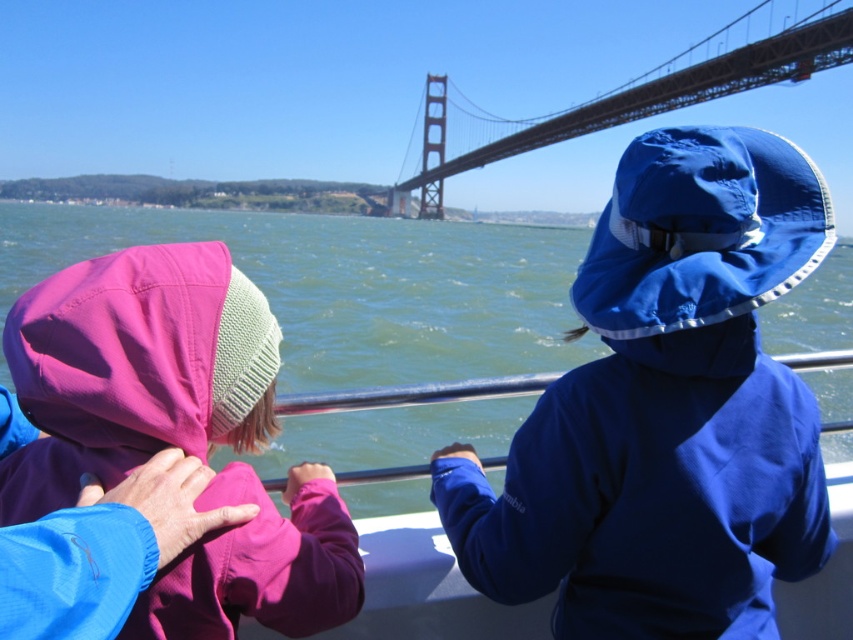
You are a photographer standing at the back of the boat. You want to take a closeup photo of the blue matte sun hat at upper right. Given that your camera has a maximum focus range of 7 feet, will you be able to capture the hat clearly?

The blue matte sun hat at upper right is 7.38 feet away from the camera. Since the maximum focus range is 7 feet, the camera cannot focus on the hat clearly at this distance.

You are navigating a small boat and need to avoid the green water at center. Where should you steer your boat to stay clear of it?

The green water at center is located at point (x=349, y=285), so steering the boat away from this coordinate will help avoid it.